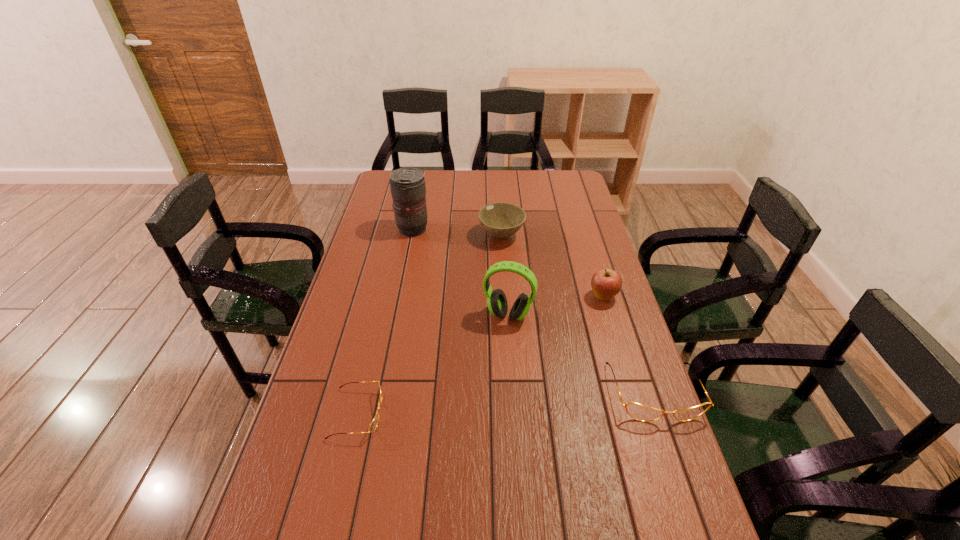
In the image, there is a desktop. Where is `vacant space at the left edge`? vacant space at the left edge is located at coordinates (357, 294).

Locate an element on the screen. This screenshot has height=540, width=960. vacant space at the right edge of the desktop is located at coordinates (600, 308).

Locate an element on the screen. Image resolution: width=960 pixels, height=540 pixels. blank space at the far right corner of the desktop is located at coordinates (561, 192).

The image size is (960, 540). Identify the location of free spot between the apple and the fifth shortest object. (556, 306).

The image size is (960, 540). What are the coordinates of `free space between the right spectacles and the bowl` in the screenshot? It's located at (578, 314).

The image size is (960, 540). Find the location of `blank region between the taller spectacles and the apple`. blank region between the taller spectacles and the apple is located at coordinates (629, 345).

The image size is (960, 540). I want to click on vacant space that's between the fifth shortest object and the taller spectacles, so click(x=581, y=354).

The image size is (960, 540). I want to click on free spot between the fifth tallest object and the shortest object, so click(506, 403).

You are a GUI agent. You are given a task and a screenshot of the screen. Output one action in this format:
    pyautogui.click(x=<x>, y=<y>)
    Task: Click on the vacant region between the bowl and the shorter spectacles
    
    Given the screenshot: What is the action you would take?
    pyautogui.click(x=429, y=325)

Image resolution: width=960 pixels, height=540 pixels. I want to click on empty location between the fifth shortest object and the taller spectacles, so click(x=581, y=354).